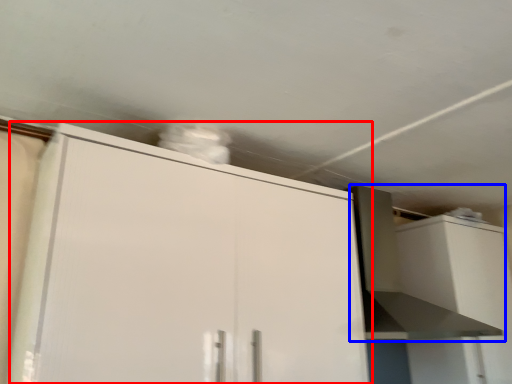
Question: Which object is closer to the camera taking this photo, cabinetry (highlighted by a red box) or vent (highlighted by a blue box)?

Choices:
 (A) cabinetry
 (B) vent

Answer: (A)